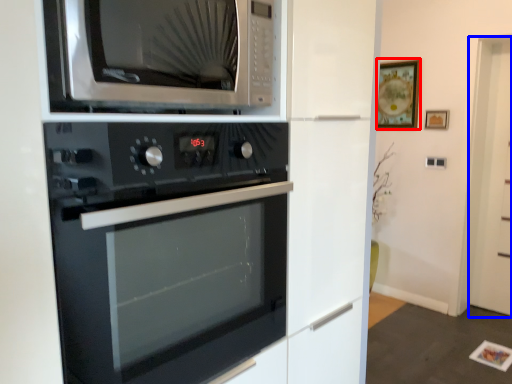
Question: Which point is further to the camera, picture frame (highlighted by a red box) or glass door (highlighted by a blue box)?

Choices:
 (A) picture frame
 (B) glass door

Answer: (A)